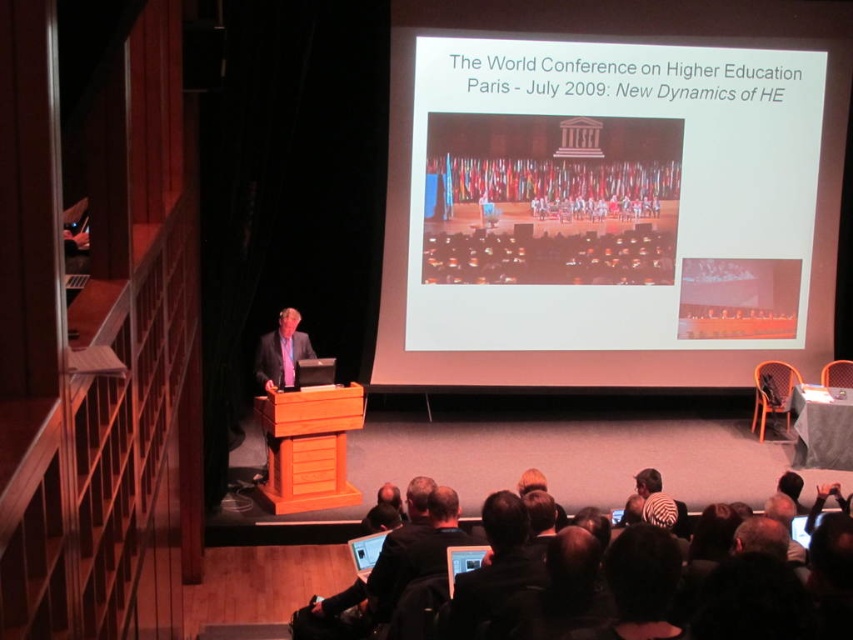
Question: Which point is farther to the camera?

Choices:
 (A) (473, 570)
 (B) (370, 552)

Answer: (B)

Question: Is black leather jacket at lower center wider than wooden podium at center?

Choices:
 (A) no
 (B) yes

Answer: (A)

Question: Based on their relative distances, which object is nearer to the matte black laptop at lower center?

Choices:
 (A) white matte projection screen at upper center
 (B) black leather jacket at lower center
 (C) matte black screen at center

Answer: (C)

Question: Observing the image, what is the correct spatial positioning of black leather jacket at lower center in reference to matte black screen at center?

Choices:
 (A) below
 (B) above

Answer: (B)

Question: Considering the relative positions of black leather jacket at lower center and matte black screen at center in the image provided, where is black leather jacket at lower center located with respect to matte black screen at center?

Choices:
 (A) left
 (B) right

Answer: (B)

Question: Which of the following is the farthest from the observer?

Choices:
 (A) (361, 428)
 (B) (363, 556)

Answer: (A)